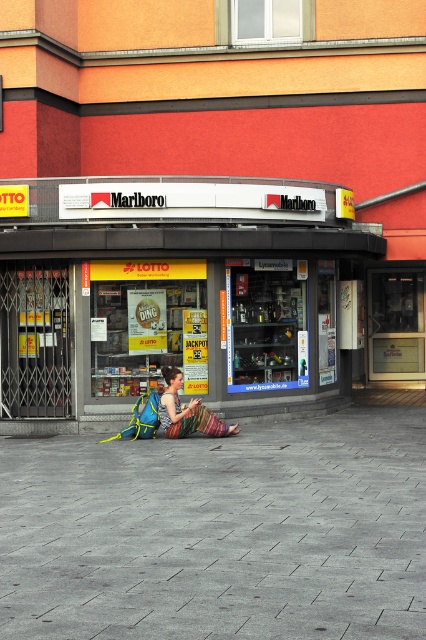
Question: In this image, where is gray concrete pavement at lower center located relative to matte black store at center?

Choices:
 (A) right
 (B) left

Answer: (A)

Question: Can you confirm if gray concrete pavement at lower center is smaller than matte black store at center?

Choices:
 (A) yes
 (B) no

Answer: (B)

Question: Which point appears farthest from the camera in this image?

Choices:
 (A) (180, 355)
 (B) (187, 410)

Answer: (A)

Question: Which object is positioned farthest from the gray concrete pavement at lower center?

Choices:
 (A) multicolored woven skirt at center
 (B) matte black store at center

Answer: (B)

Question: Is matte black store at center below multicolored woven skirt at center?

Choices:
 (A) yes
 (B) no

Answer: (B)

Question: Which object is positioned closest to the matte black store at center?

Choices:
 (A) gray concrete pavement at lower center
 (B) multicolored woven skirt at center

Answer: (B)